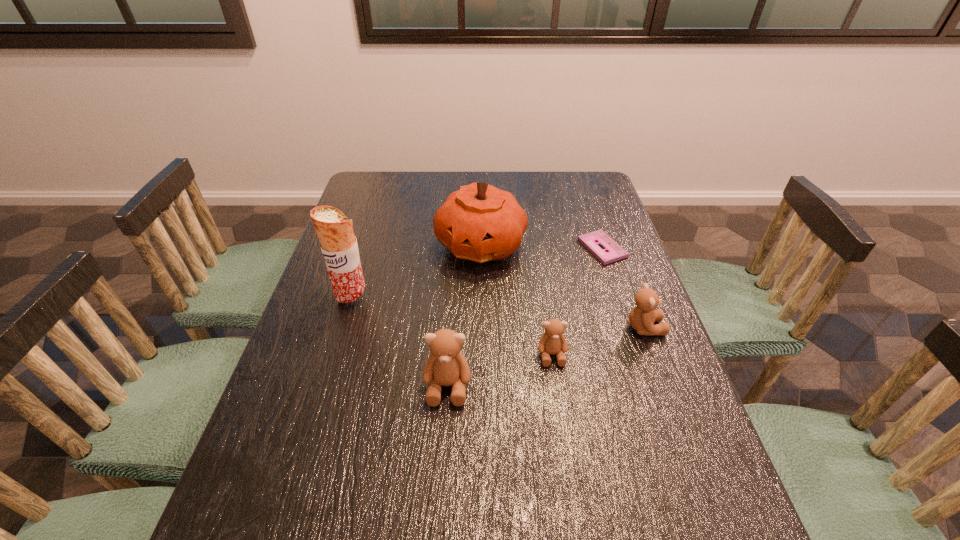
Please point out where to position a new teddy bear on the left to maintain spacing. Please provide its 2D coordinates. Your answer should be formatted as a tuple, i.e. [(x, y)], where the tuple contains the x and y coordinates of a point satisfying the conditions above.

[(329, 421)]